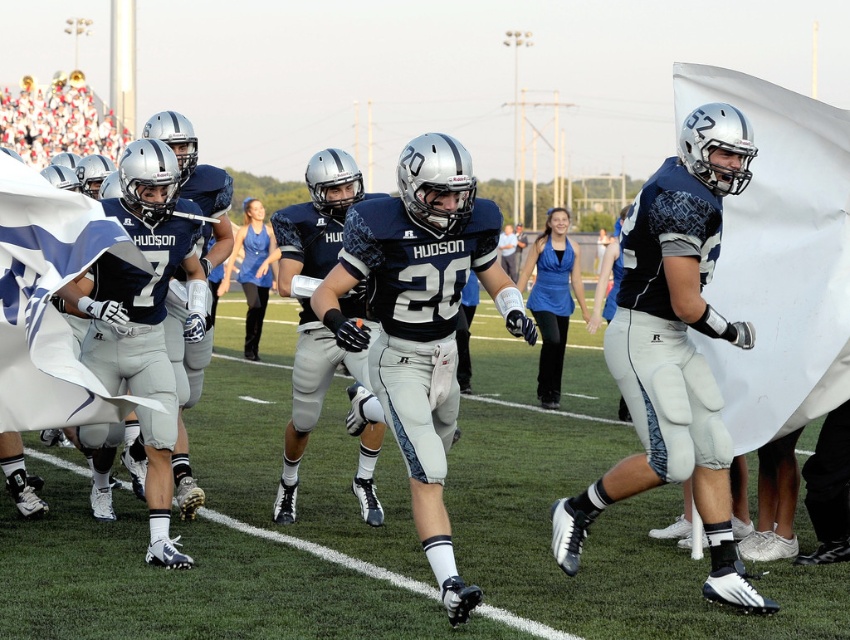
Question: Is white fabric flag at right smaller than white fabric flag at left?

Choices:
 (A) yes
 (B) no

Answer: (B)

Question: Which point is closer to the camera taking this photo?

Choices:
 (A) (10, 369)
 (B) (780, 408)

Answer: (A)

Question: Which object appears farthest from the camera in this image?

Choices:
 (A) white fabric flag at right
 (B) white fabric flag at left

Answer: (A)

Question: Where is white fabric flag at right located in relation to white fabric flag at left in the image?

Choices:
 (A) left
 (B) right

Answer: (B)

Question: Does white fabric flag at right have a smaller size compared to white fabric flag at left?

Choices:
 (A) yes
 (B) no

Answer: (B)